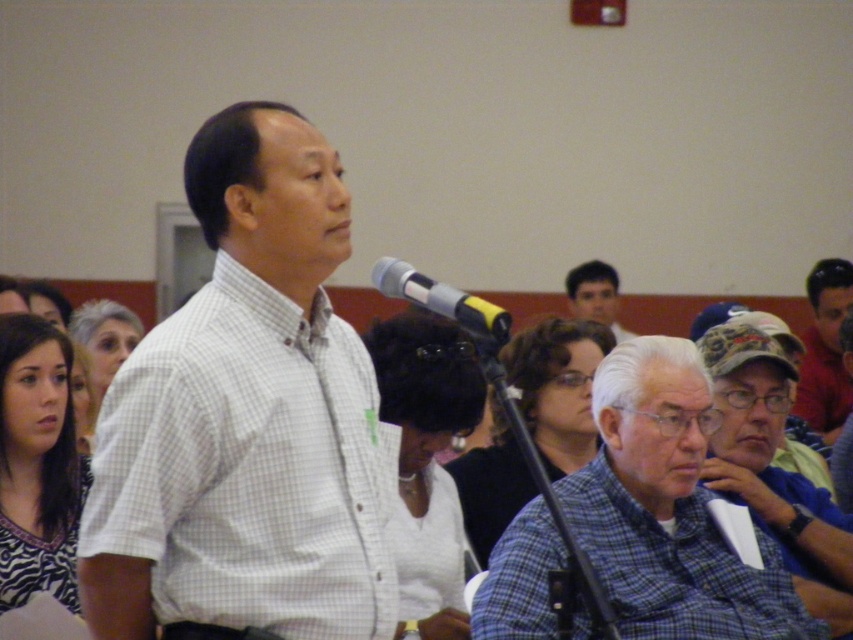
Question: Is white shirt at center further to the viewer compared to blue plaid shirt at center?

Choices:
 (A) yes
 (B) no

Answer: (B)

Question: Which point is closer to the camera?

Choices:
 (A) (10, 499)
 (B) (270, 365)
 (C) (436, 422)
 (D) (525, 605)

Answer: (B)

Question: Can you confirm if white checkered shirt at center is positioned above silver metallic microphone at center?

Choices:
 (A) no
 (B) yes

Answer: (A)

Question: Which point is closer to the camera?

Choices:
 (A) matte blue shirt at center
 (B) blue plaid shirt at lower right
 (C) white checkered shirt at center
 (D) white shirt at center

Answer: (C)

Question: Considering the real-world distances, which object is farthest from the zebra print shirt at lower left?

Choices:
 (A) silver metallic microphone at center
 (B) white shirt at center
 (C) blue plaid shirt at lower right

Answer: (A)

Question: Does white shirt at center appear over blue plaid shirt at center?

Choices:
 (A) yes
 (B) no

Answer: (A)